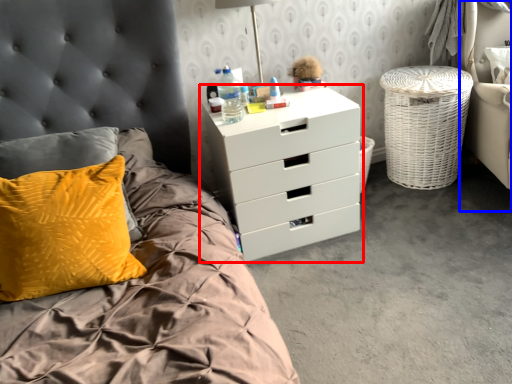
Question: Which object is further to the camera taking this photo, chest of drawers (highlighted by a red box) or armchair (highlighted by a blue box)?

Choices:
 (A) chest of drawers
 (B) armchair

Answer: (A)